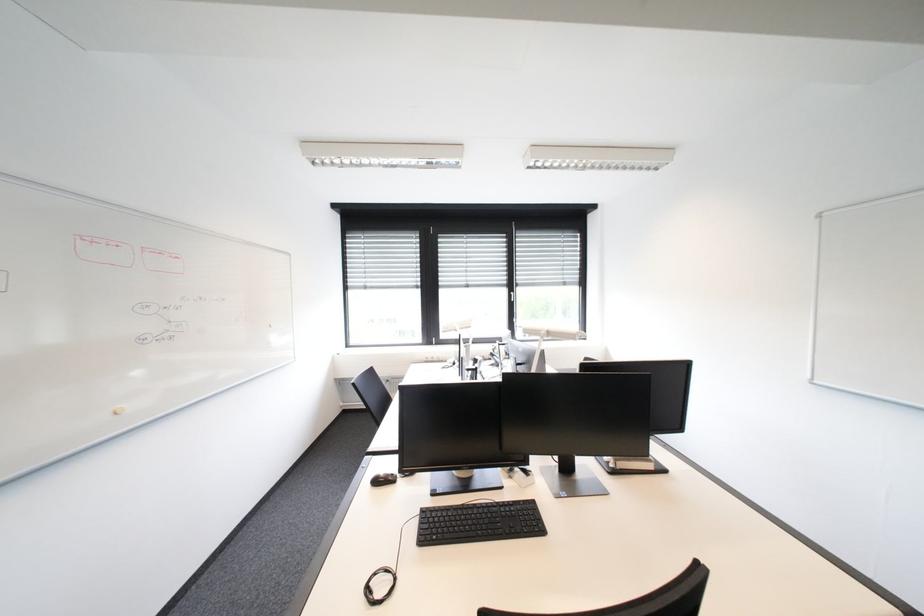
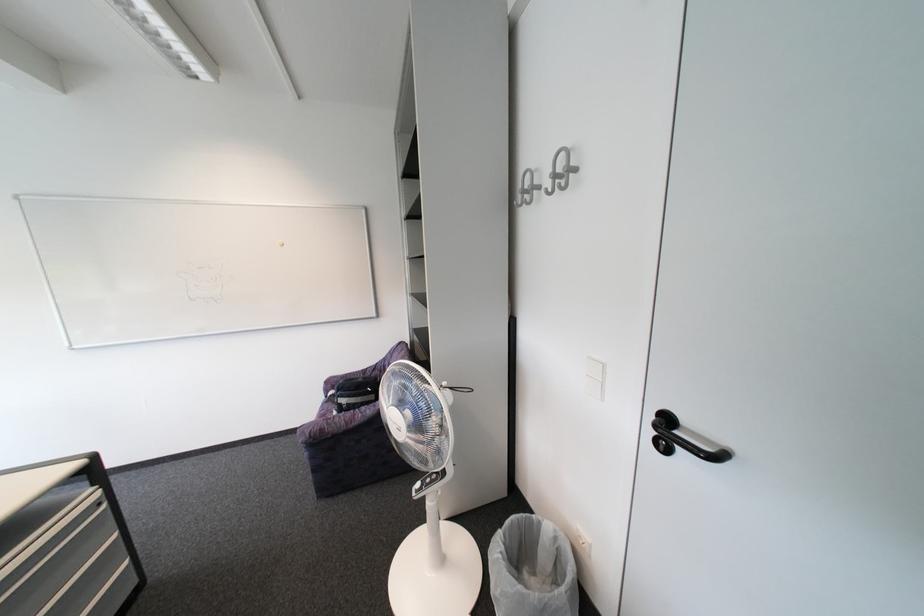
Question: The camera is either moving clockwise (left) or counter-clockwise (right) around the object. The first image is from the beginning of the video and the second image is from the end. Is the camera moving left or right when shooting the video?

Choices:
 (A) Left
 (B) Right

Answer: (A)